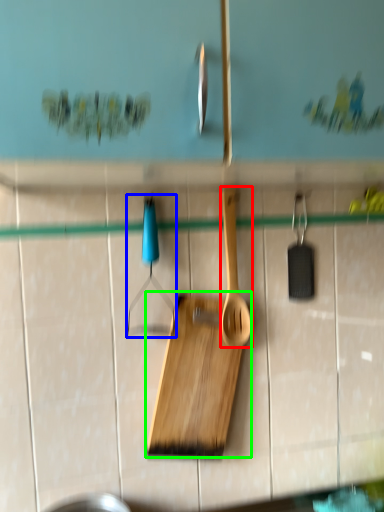
Question: Which is farther away from spatula (highlighted by a red box)? hanger (highlighted by a blue box) or cutting board (highlighted by a green box)?

Choices:
 (A) hanger
 (B) cutting board

Answer: (A)